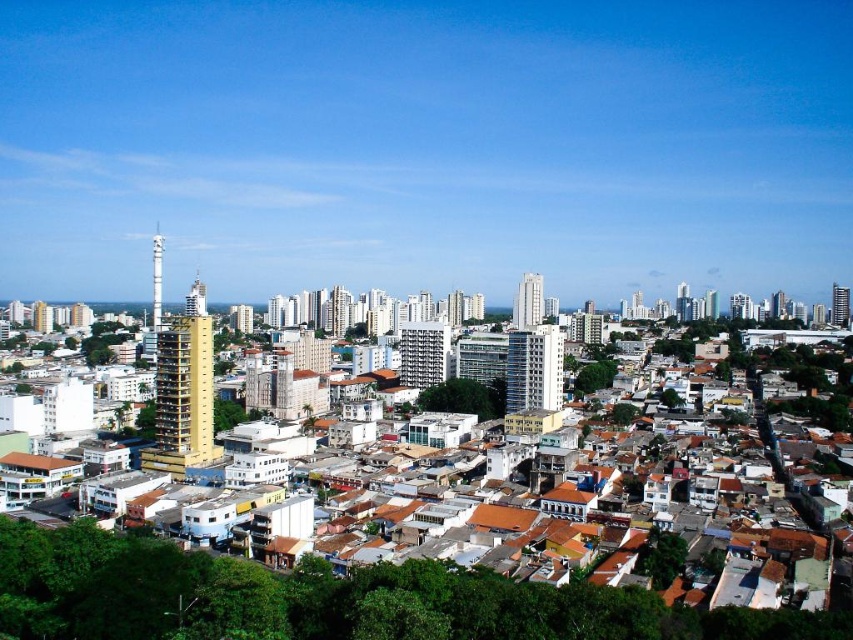
Between gray concrete building at center and white glass building at center, which one appears on the right side from the viewer's perspective?

white glass building at center

Does gray concrete building at center appear under white glass building at center?

Yes.

Who is more forward, (447,353) or (538,289)?

Point (447,353) is more forward.

Locate an element on the screen. The height and width of the screenshot is (640, 853). gray concrete building at center is located at coordinates (422, 353).

Based on the photo, who is taller, white glass building at center or smooth glass skyscraper at center?

With more height is white glass building at center.

In the scene shown: Who is lower down, white glass building at center or smooth glass skyscraper at center?

smooth glass skyscraper at center is lower down.

Describe the element at coordinates (527, 300) in the screenshot. I see `white glass building at center` at that location.

Where is `white glass building at center`? white glass building at center is located at coordinates (527, 300).

Between point (154, 246) and point (335, 333), which one is positioned behind?

The point (154, 246) is more distant.

Is the position of gold metallic tower at center-left less distant than that of smooth glass skyscraper at center?

Yes, it is in front of smooth glass skyscraper at center.

Who is more distant from viewer, (160, 320) or (340, 310)?

The point (340, 310) is more distant.

In order to click on gold metallic tower at center-left in this screenshot , I will do `click(155, 276)`.